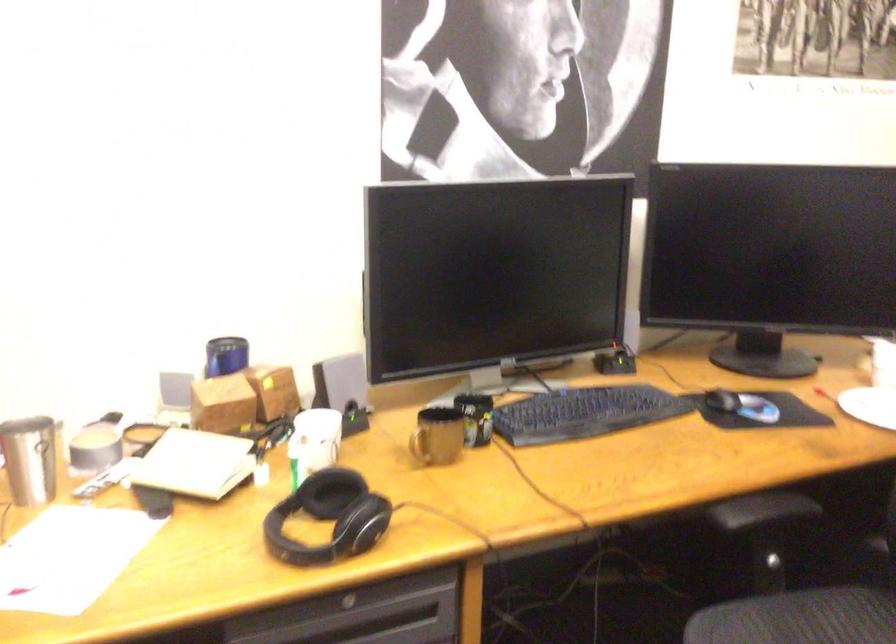
Where is `white paper cup`? white paper cup is located at coordinates (314, 440).